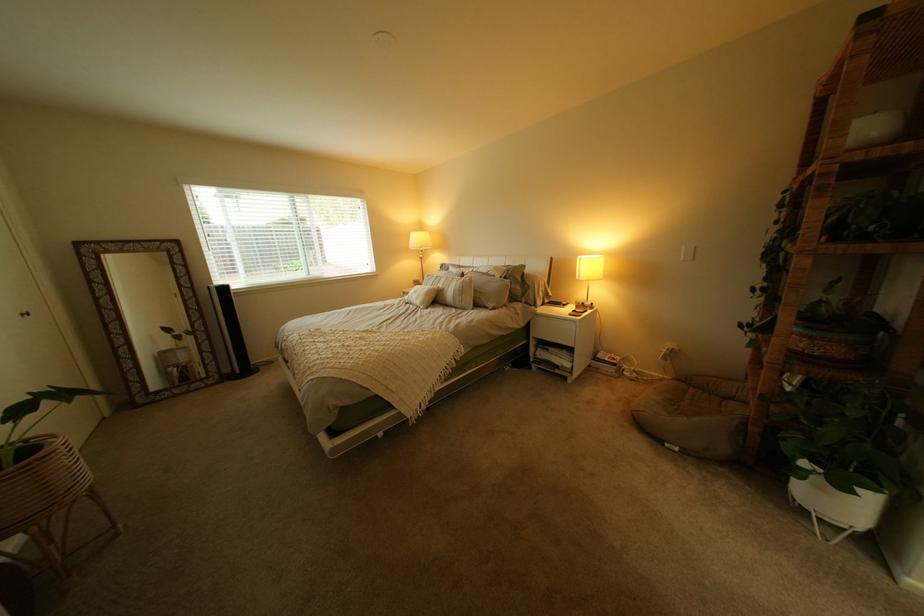
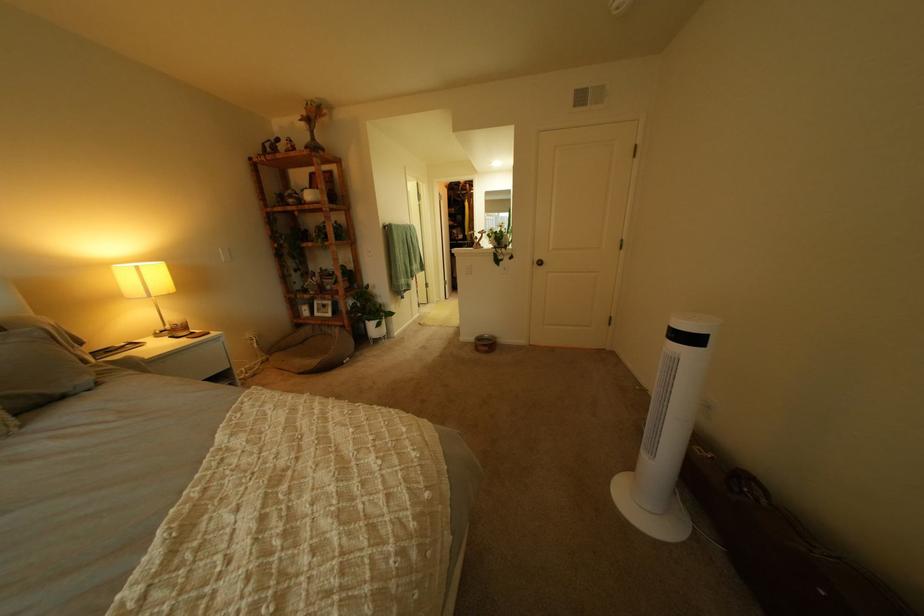
In the second image, find the point that corresponds to the point at 509,310 in the first image.

(115, 385)